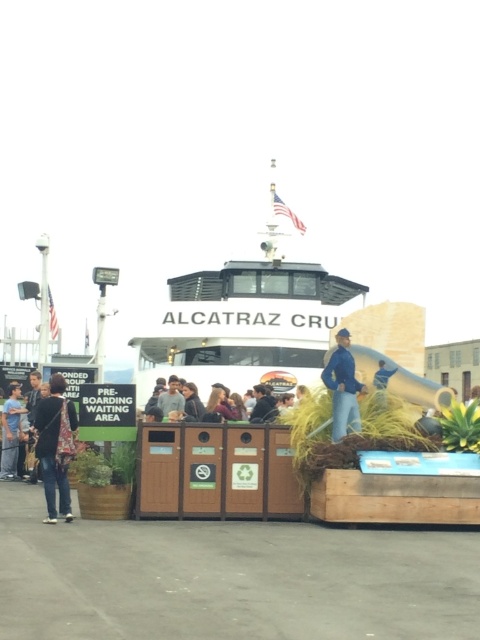
Question: Which of these objects is positioned closest to the matte black jacket at center?

Choices:
 (A) blue denim jacket at center
 (B) light brown leather jacket at center

Answer: (A)

Question: Among these objects, which one is farthest from the camera?

Choices:
 (A) dark blue jeans at lower left
 (B) blue denim jacket at center
 (C) matte black jacket at center
 (D) light brown leather jacket at center

Answer: (C)

Question: Is dark blue jeans at lower left above blue denim jacket at center?

Choices:
 (A) yes
 (B) no

Answer: (B)

Question: From the image, what is the correct spatial relationship of dark blue jeans at lower left in relation to matte black jacket at center?

Choices:
 (A) left
 (B) right

Answer: (A)

Question: Does matte black jacket at center appear over light brown leather jacket at center?

Choices:
 (A) yes
 (B) no

Answer: (B)

Question: Which point is farther from the camera taking this photo?

Choices:
 (A) (61, 410)
 (B) (216, 385)
 (C) (340, 394)
 (D) (164, 404)

Answer: (B)